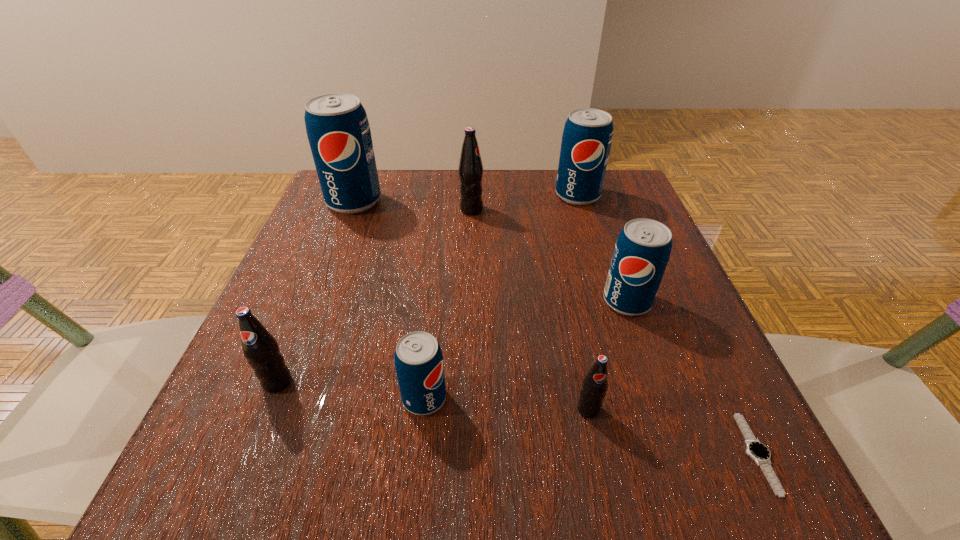
Where is `the nearest blue pop`? the nearest blue pop is located at coordinates 418,358.

Locate an element on the screen. the fifth pop from left to right is located at coordinates click(x=595, y=384).

I want to click on the nearest black pop, so click(x=595, y=384).

Where is `the rightmost object`? Image resolution: width=960 pixels, height=540 pixels. the rightmost object is located at coordinates (760, 453).

The height and width of the screenshot is (540, 960). In order to click on watch in this screenshot , I will do `click(760, 453)`.

You are a GUI agent. You are given a task and a screenshot of the screen. Output one action in this format:
    pyautogui.click(x=<x>, y=<y>)
    Task: Click on the free space located on the right of the biggest blue pop
    Image resolution: width=960 pixels, height=540 pixels.
    Given the screenshot: What is the action you would take?
    pyautogui.click(x=478, y=201)

This screenshot has width=960, height=540. Identify the location of vacant position located 0.290m on the left of the third smallest blue pop. pyautogui.click(x=436, y=195).

This screenshot has width=960, height=540. Find the location of `free location located 0.130m on the front label of the farthest black pop`. free location located 0.130m on the front label of the farthest black pop is located at coordinates (540, 210).

Locate an element on the screen. The width and height of the screenshot is (960, 540). free region located on the left of the second nearest blue pop is located at coordinates (432, 301).

Find the location of a particular element. Image resolution: width=960 pixels, height=540 pixels. vacant region located 0.080m on the front label of the leftmost black pop is located at coordinates (252, 446).